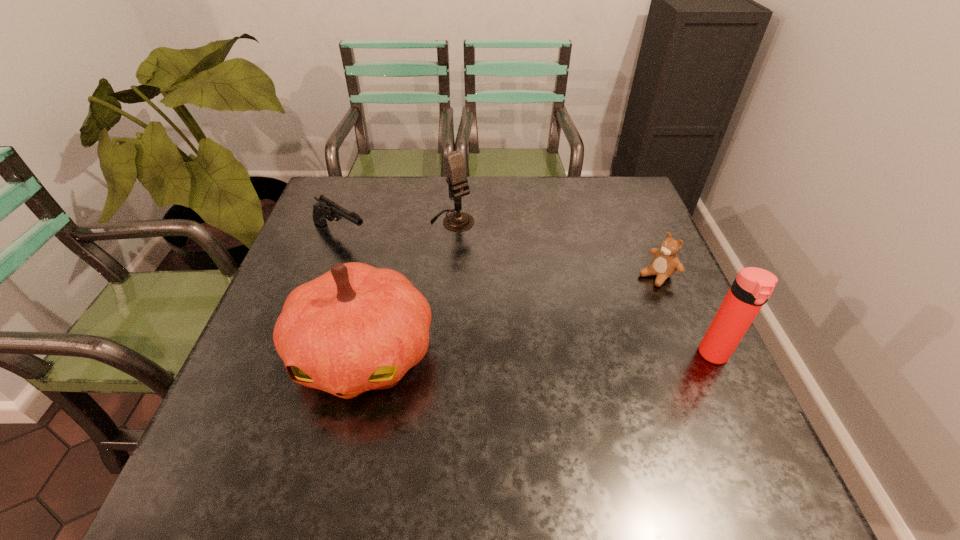
Find the location of a particular element. The image size is (960, 540). vacant position in the image that satisfies the following two spatial constraints: 1. on the front side of the gun; 2. on the left side of the teddy bear is located at coordinates click(325, 275).

At what (x,y) coordinates should I click in order to perform the action: click on vacant space that satisfies the following two spatial constraints: 1. on the back side of the gun; 2. on the left side of the microphone. Please return your answer as a coordinate pair (x, y). Looking at the image, I should click on (346, 220).

The height and width of the screenshot is (540, 960). I want to click on free space that satisfies the following two spatial constraints: 1. on the front side of the thermos bottle; 2. on the left side of the gun, so click(x=297, y=355).